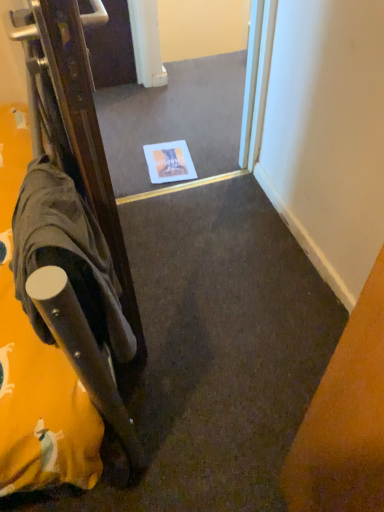
Question: Does white glossy mirror at center have a smaller size compared to dark gray fabric robe at left?

Choices:
 (A) yes
 (B) no

Answer: (B)

Question: Is white glossy mirror at center facing away from dark gray fabric robe at left?

Choices:
 (A) no
 (B) yes

Answer: (A)

Question: Is white glossy mirror at center behind dark gray fabric robe at left?

Choices:
 (A) yes
 (B) no

Answer: (A)

Question: Is white glossy mirror at center directly adjacent to dark gray fabric robe at left?

Choices:
 (A) yes
 (B) no

Answer: (B)

Question: Would you say white glossy mirror at center is outside dark gray fabric robe at left?

Choices:
 (A) no
 (B) yes

Answer: (B)

Question: Does white glossy mirror at center appear on the left side of dark gray fabric robe at left?

Choices:
 (A) yes
 (B) no

Answer: (B)

Question: Is dark gray fabric robe at left outside white glossy mirror at center?

Choices:
 (A) yes
 (B) no

Answer: (A)

Question: Is dark gray fabric robe at left wider than white glossy mirror at center?

Choices:
 (A) yes
 (B) no

Answer: (B)

Question: Is dark gray fabric robe at left facing towards white glossy mirror at center?

Choices:
 (A) no
 (B) yes

Answer: (A)

Question: From a real-world perspective, is dark gray fabric robe at left located higher than white glossy mirror at center?

Choices:
 (A) no
 (B) yes

Answer: (B)

Question: Considering the relative sizes of dark gray fabric robe at left and white glossy mirror at center in the image provided, is dark gray fabric robe at left bigger than white glossy mirror at center?

Choices:
 (A) yes
 (B) no

Answer: (B)

Question: Is dark gray fabric robe at left in contact with white glossy mirror at center?

Choices:
 (A) no
 (B) yes

Answer: (A)

Question: Considering the positions of dark gray fabric robe at left and white glossy mirror at center in the image, is dark gray fabric robe at left bigger or smaller than white glossy mirror at center?

Choices:
 (A) big
 (B) small

Answer: (B)